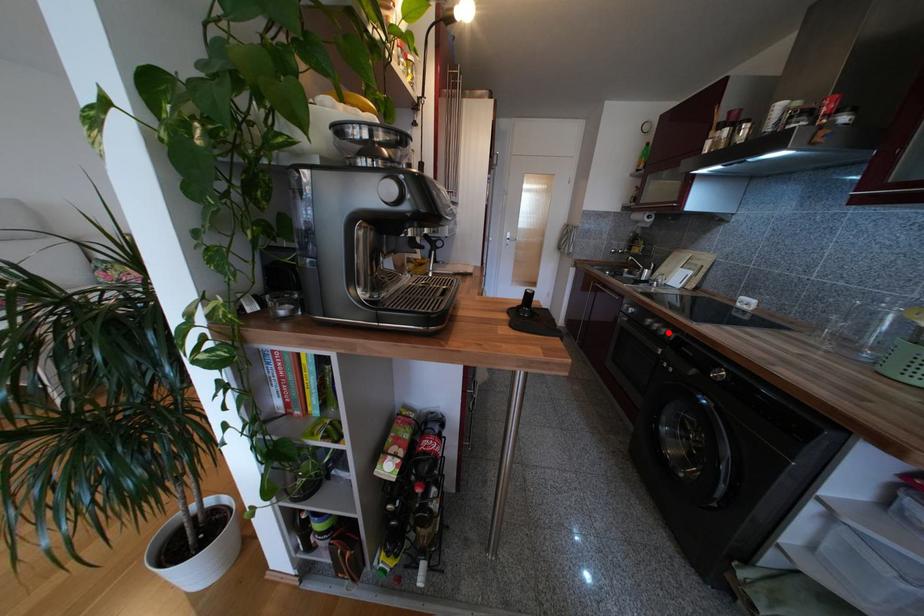
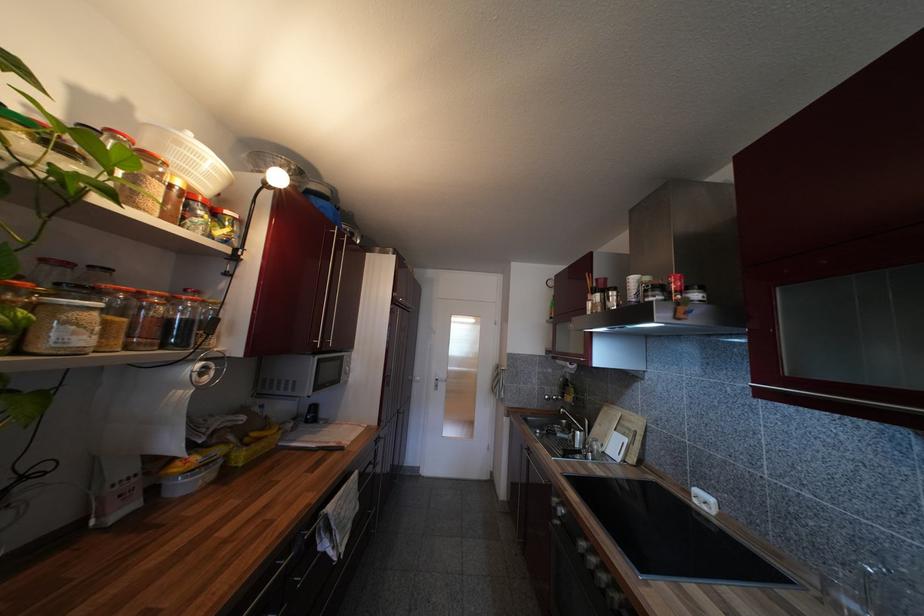
Locate, in the second image, the point that corresponds to the highlighted location in the first image.

(609, 580)